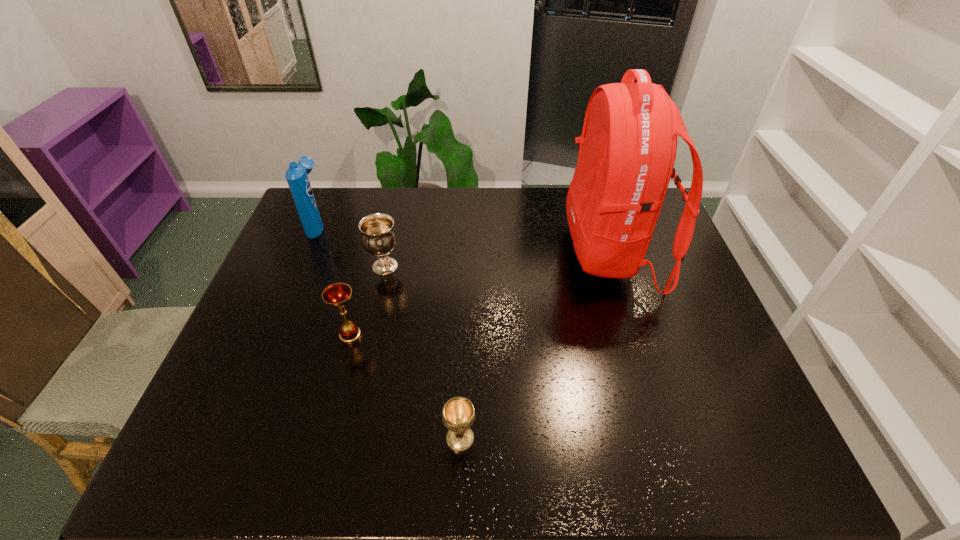
The height and width of the screenshot is (540, 960). Find the location of `the rightmost object`. the rightmost object is located at coordinates (628, 145).

This screenshot has width=960, height=540. I want to click on backpack, so click(628, 145).

This screenshot has height=540, width=960. In order to click on the leftmost object in this screenshot , I will do `click(296, 175)`.

Where is `the fourth shortest object`? the fourth shortest object is located at coordinates (296, 175).

The width and height of the screenshot is (960, 540). Identify the location of the farthest chalice. (379, 238).

Find the location of a particular element. Image resolution: width=960 pixels, height=540 pixels. the second farthest chalice is located at coordinates 336,295.

You are a GUI agent. You are given a task and a screenshot of the screen. Output one action in this format:
    pyautogui.click(x=<x>, y=<y>)
    Task: Click on the rightmost chalice
    The width and height of the screenshot is (960, 540).
    Given the screenshot: What is the action you would take?
    pyautogui.click(x=458, y=415)

Locate an element on the screen. The height and width of the screenshot is (540, 960). the nearest chalice is located at coordinates (458, 415).

In order to click on free region located 0.100m on the main compartment of the backpack in this screenshot , I will do `click(534, 253)`.

This screenshot has height=540, width=960. Identify the location of free space located 0.230m on the main compartment of the backpack. (492, 253).